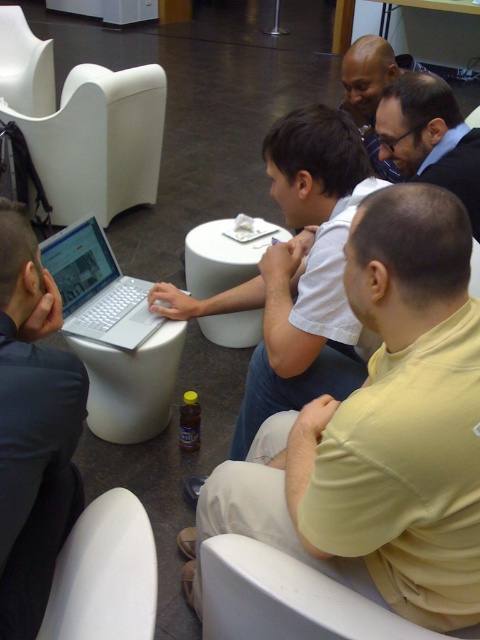
Question: Can you confirm if matte black laptop at left is positioned to the right of silver metallic laptop at center?

Choices:
 (A) yes
 (B) no

Answer: (A)

Question: Estimate the real-world distances between objects in this image. Which object is farther from the white matte chair at upper left?

Choices:
 (A) white plastic stool at lower left
 (B) white plastic stool at center

Answer: (A)

Question: Is white cotton shirt at center to the left of white plastic chair at lower center from the viewer's perspective?

Choices:
 (A) yes
 (B) no

Answer: (B)

Question: Which of the following is the farthest from the observer?

Choices:
 (A) (204, 541)
 (B) (343, 556)
 (C) (188, 252)
 (D) (83, 627)

Answer: (C)

Question: Can you confirm if white matte chair at left is thinner than white matte chair at upper left?

Choices:
 (A) no
 (B) yes

Answer: (A)

Question: Which object appears closest to the camera in this image?

Choices:
 (A) white cotton shirt at center
 (B) white matte chair at upper left
 (C) white matte chair at left

Answer: (A)